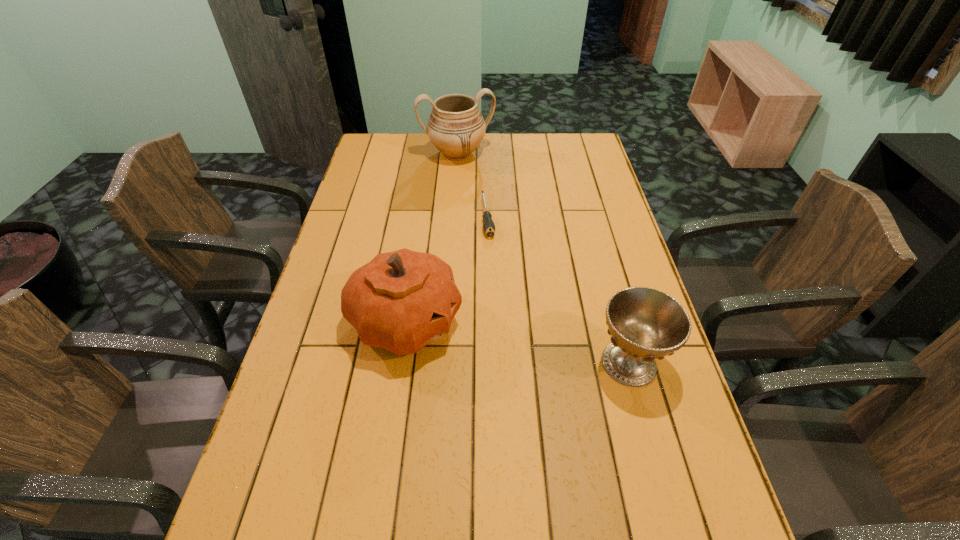
The image size is (960, 540). In order to click on vacant spot on the desktop that is between the pumpkin and the rightmost object and is positioned on the front-facing side of the urn in this screenshot , I will do `click(524, 343)`.

At what (x,y) coordinates should I click in order to perform the action: click on vacant space on the desktop that is between the pumpkin and the third tallest object and is positioned at the tip of the second farthest object. Please return your answer as a coordinate pair (x, y). The height and width of the screenshot is (540, 960). Looking at the image, I should click on (512, 341).